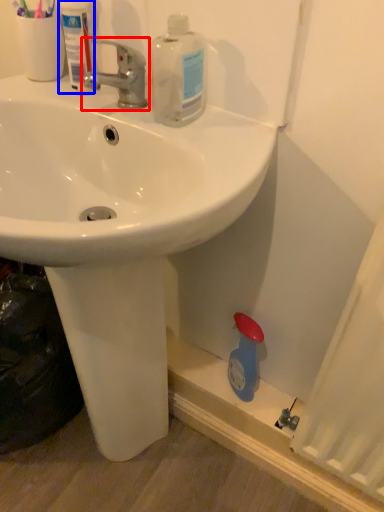
Question: Which object appears farthest to the camera in this image, tap (highlighted by a red box) or mouthwash (highlighted by a blue box)?

Choices:
 (A) tap
 (B) mouthwash

Answer: (B)